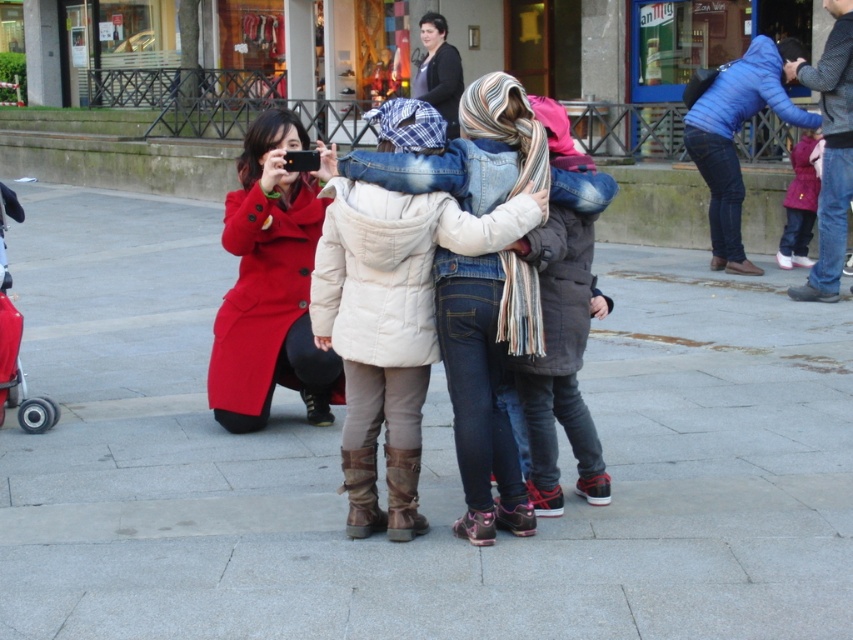
You are a photographer standing on the gray concrete pavement at center and want to take a photo of the pink fleece jacket at upper right. Can you estimate whether you need to move closer or farther away to get the jacket in focus?

The distance between the gray concrete pavement at center and the pink fleece jacket at upper right is 8.78 feet. Since this distance is within the typical focusing range of most cameras, you likely don

You are standing at point (271, 284) in the image. What is the closest object to you?

The closest object to you at point (271, 284) is the matte red coat at center.

You are a photographer trying to capture a group photo of the three people in the scene. The white puffy coat at center and the blue denim jeans at upper right are part of the subjects. Based on their sizes, which one would you need to position closer to the camera to ensure they appear the same size in the photo?

The white puffy coat at center is smaller in size compared to the blue denim jeans at upper right. To make them appear the same size in the photo, you should position the white puffy coat at center closer to the camera since smaller objects need to be nearer to the lens to match the size of a larger object farther away.